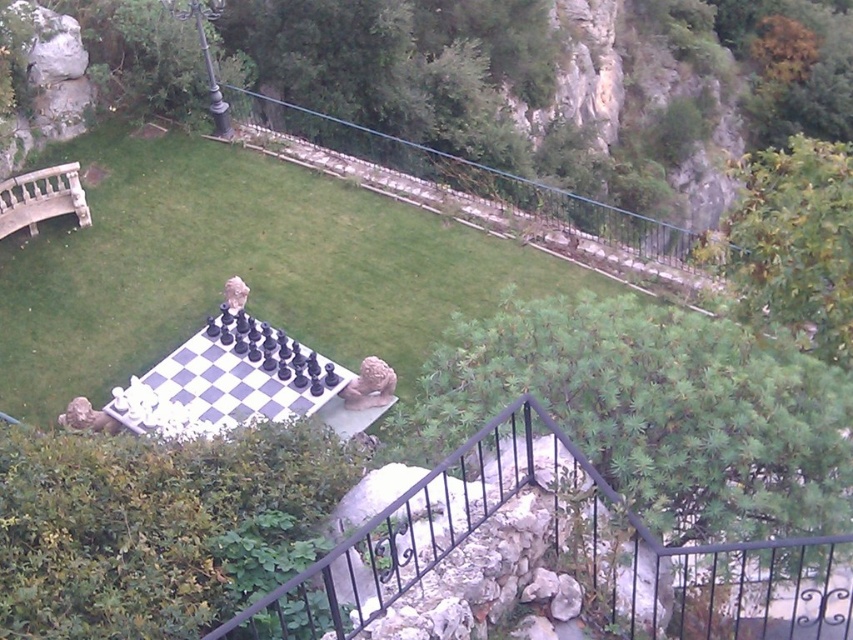
Question: Which point is farther to the camera?

Choices:
 (A) stone balustrade at left
 (B) white glossy chess set at center

Answer: (A)

Question: Does white glossy chess set at center have a greater width compared to stone balustrade at left?

Choices:
 (A) yes
 (B) no

Answer: (A)

Question: Which object is the closest to the white stone chessboard at center?

Choices:
 (A) stone balustrade at left
 (B) white glossy chess set at center

Answer: (A)

Question: Which point appears farthest from the camera in this image?

Choices:
 (A) (3, 237)
 (B) (326, 396)
 (C) (80, 332)

Answer: (A)

Question: Can you confirm if white glossy chess set at center is positioned to the right of stone balustrade at left?

Choices:
 (A) no
 (B) yes

Answer: (B)

Question: Does white stone chessboard at center appear on the right side of stone balustrade at left?

Choices:
 (A) no
 (B) yes

Answer: (B)